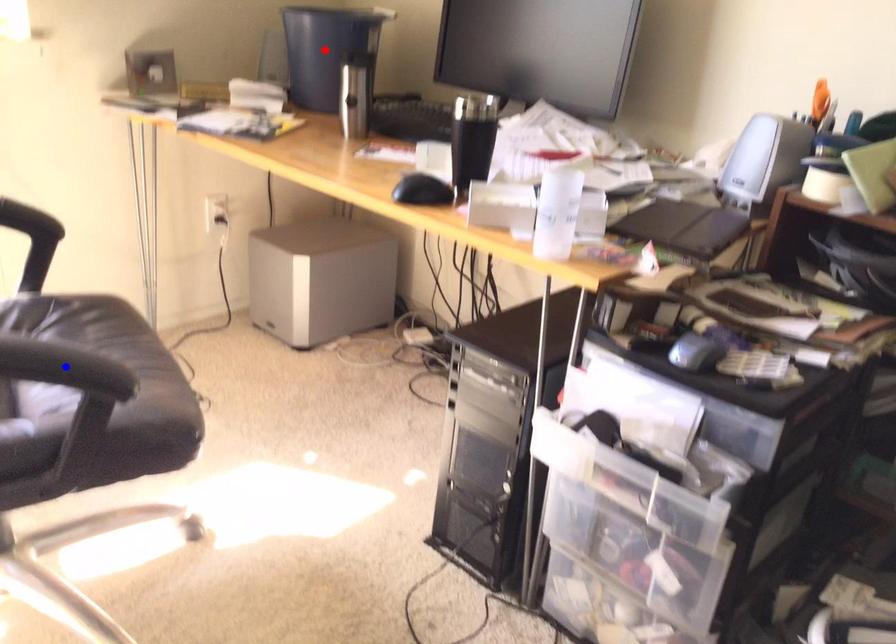
Question: In the image, two points are highlighted. Which point is nearer to the camera? Reply with the corresponding letter.

Choices:
 (A) blue point
 (B) red point

Answer: (A)